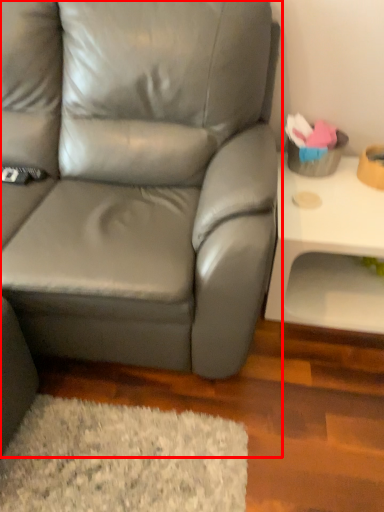
Question: Considering the relative positions of studio couch (annotated by the red box) and table in the image provided, where is studio couch (annotated by the red box) located with respect to the staircase?

Choices:
 (A) left
 (B) right

Answer: (A)